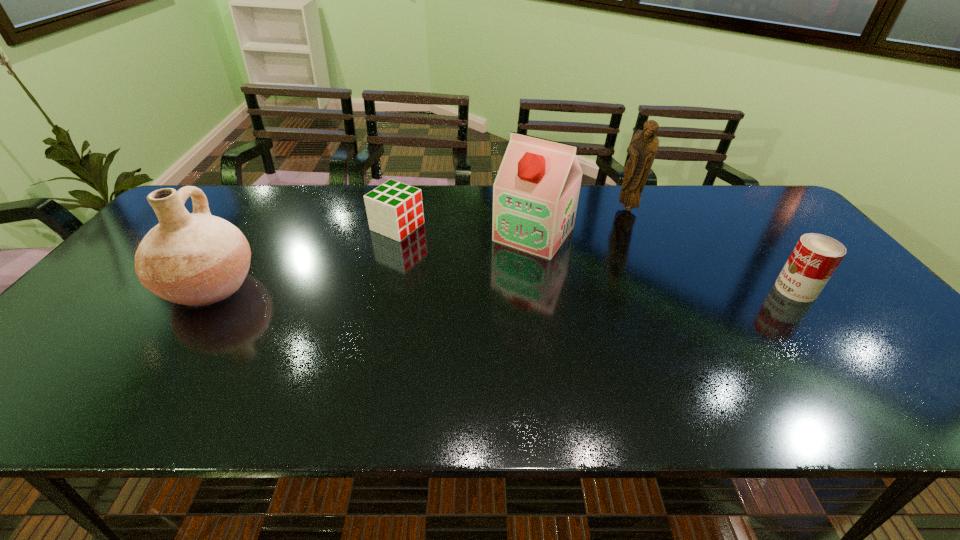
You are a GUI agent. You are given a task and a screenshot of the screen. Output one action in this format:
    pyautogui.click(x=<x>, y=<y>)
    Task: Click on the vacant space on the desktop that is between the leftmost object and the can and is positioned on the red face of the fourth object from right to left
    The image size is (960, 540).
    Given the screenshot: What is the action you would take?
    pyautogui.click(x=555, y=288)

You are a GUI agent. You are given a task and a screenshot of the screen. Output one action in this format:
    pyautogui.click(x=<x>, y=<y>)
    Task: Click on the free space on the desktop that is between the leftmost object and the fourth tallest object and is positioned with the cap open on the third object from right to left
    The image size is (960, 540).
    Given the screenshot: What is the action you would take?
    pyautogui.click(x=490, y=288)

I want to click on free space on the desktop that is between the leftmost object and the can and is positioned on the front-facing side of the fourth object from left to right, so click(x=515, y=288).